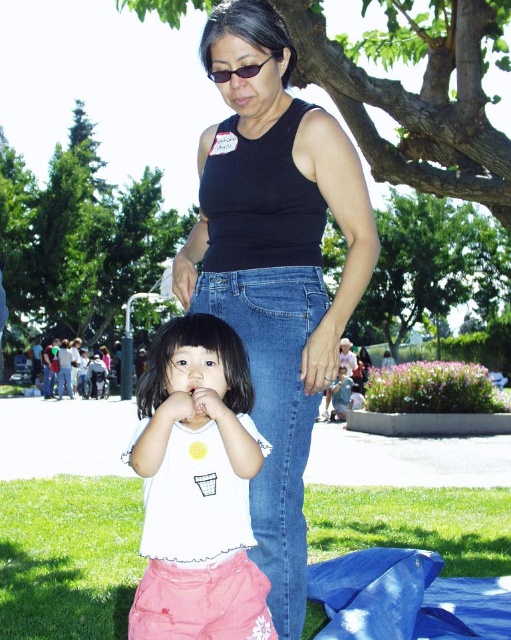
You are a photographer setting up a camera to capture the scene. The camera has a focus ring that can adjust focus distance. If you want to ensure both the white cotton shirt at center and the black plastic sunglasses at upper center are in focus, which object should you focus on first?

The white cotton shirt at center is larger in size than the black plastic sunglasses at upper center. To ensure both are in focus, you should focus on the white cotton shirt at center first because larger objects often require more precise focusing to capture details, ensuring the smaller object will also be in focus.

You are a photographer at the park and need to capture a photo where both the black matte tank top at center and the black plastic sunglasses at upper center are visible. Based on their positions, which object should you focus on first to ensure both are in frame?

The black plastic sunglasses at upper center should be focused on first since the black matte tank top at center is to the right of it, allowing the photographer to adjust the frame to include both by centering on the sunglasses and expanding to the right.

You are a photographer at the park and want to capture a clear shot of the white cotton shirt at center and the black plastic sunglasses at upper center. Which object should you focus on first to ensure it appears sharp in the photo?

The white cotton shirt at center is taller than the black plastic sunglasses at upper center. Since the shirt is taller, it would be better to focus on it first to ensure both objects are in focus as they are at different distances.